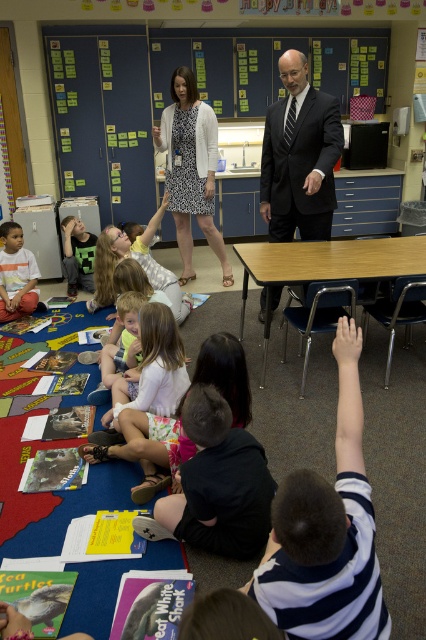
The image size is (426, 640). Identify the location of light pink fabric dress at center. (152, 368).

Identify the location of light pink fabric dress at center. This screenshot has height=640, width=426. (152, 368).

Does white textured dress at center have a greater height compared to matte plastic hand at lower right?

Yes, white textured dress at center is taller than matte plastic hand at lower right.

Is white textured dress at center bigger than matte plastic hand at lower right?

Correct, white textured dress at center is larger in size than matte plastic hand at lower right.

Identify the location of white textured dress at center. (190, 168).

Does white striped shirt at upper right have a greater height compared to matte plastic hand at lower right?

Yes.

Which is behind, point (305, 580) or point (337, 358)?

Point (337, 358)

Locate an element on the screen. white striped shirt at upper right is located at coordinates (325, 545).